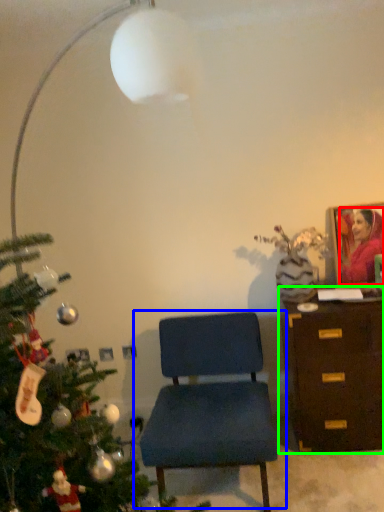
Question: Which object is positioned farthest from person (highlighted by a red box)? Select from chair (highlighted by a blue box) and chest of drawers (highlighted by a green box).

Choices:
 (A) chair
 (B) chest of drawers

Answer: (A)